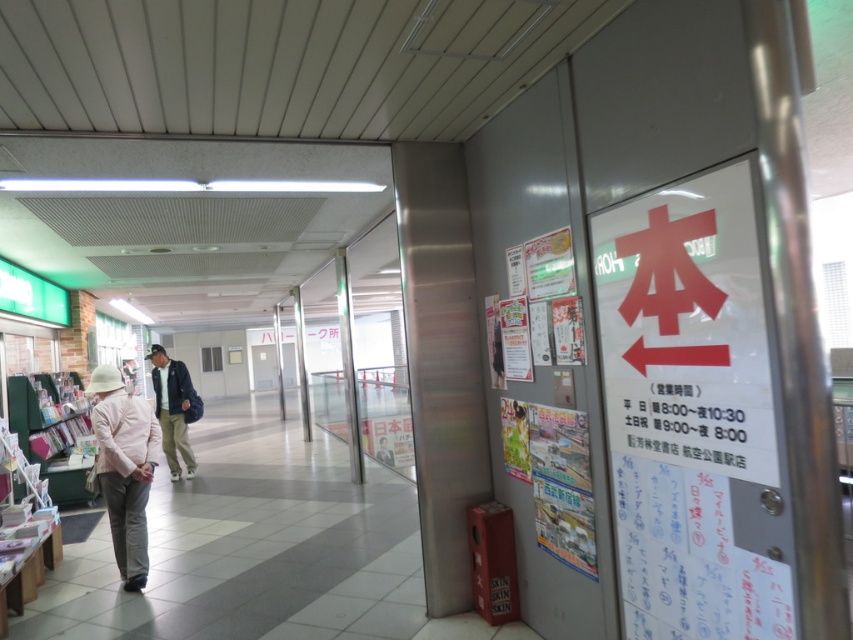
In the scene shown: Can you confirm if light pink fabric hat at left is taller than matte khaki pants at center?

In fact, light pink fabric hat at left may be shorter than matte khaki pants at center.

You are a GUI agent. You are given a task and a screenshot of the screen. Output one action in this format:
    pyautogui.click(x=<x>, y=<y>)
    Task: Click on the light pink fabric hat at left
    
    Given the screenshot: What is the action you would take?
    pyautogui.click(x=125, y=468)